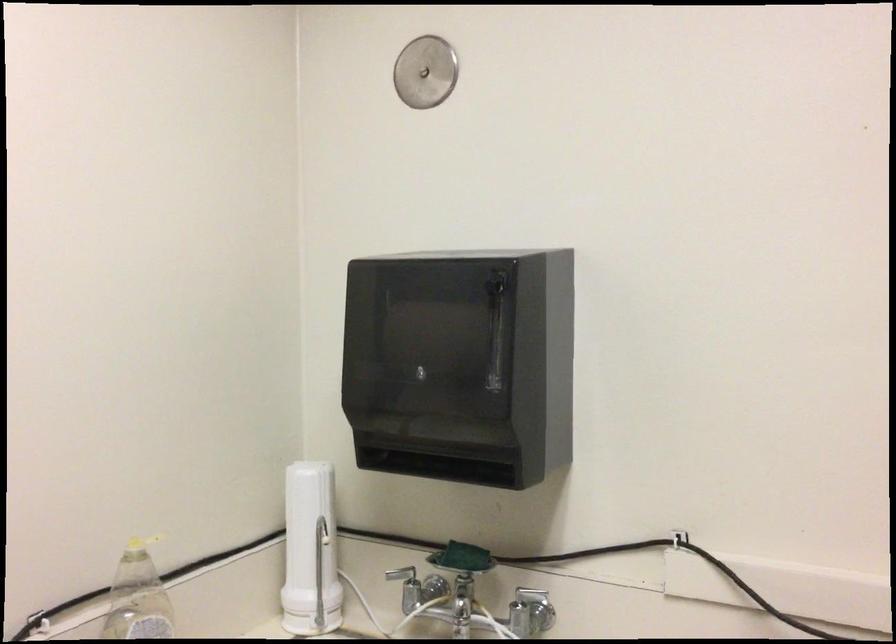
The width and height of the screenshot is (896, 644). In order to click on water filter lever in this screenshot , I will do click(x=530, y=612).